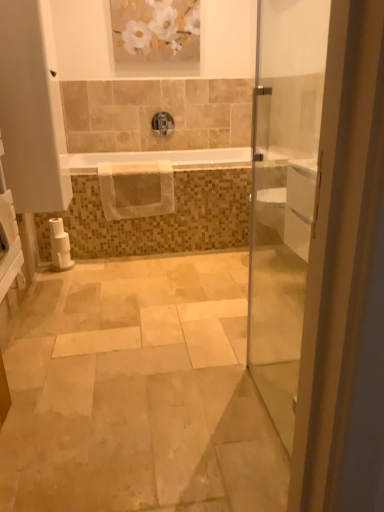
Find the location of `vacant space underneath white glossy door at right (from a real-world perspective)`. vacant space underneath white glossy door at right (from a real-world perspective) is located at coordinates (269, 401).